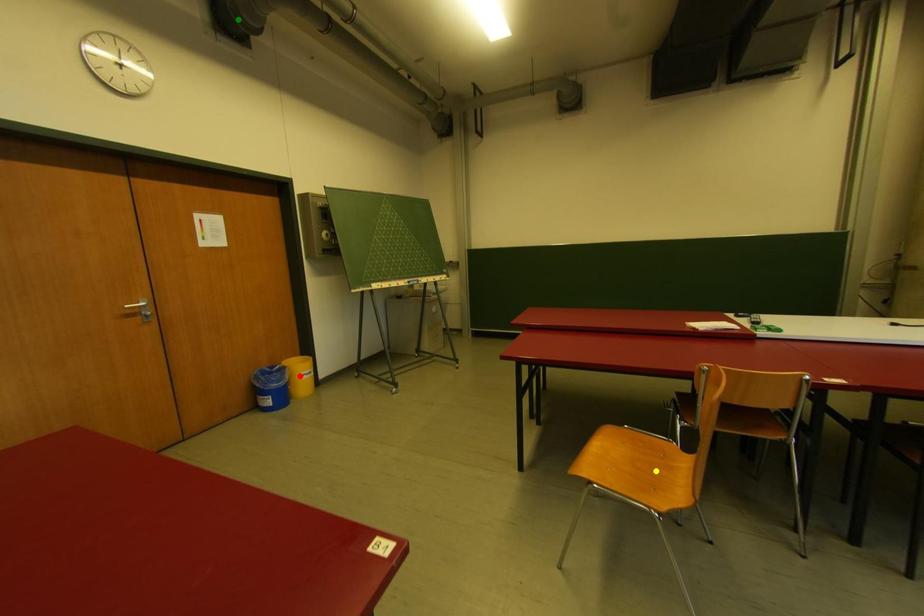
Order these from nearest to farthest:
yellow point, green point, red point

yellow point → green point → red point